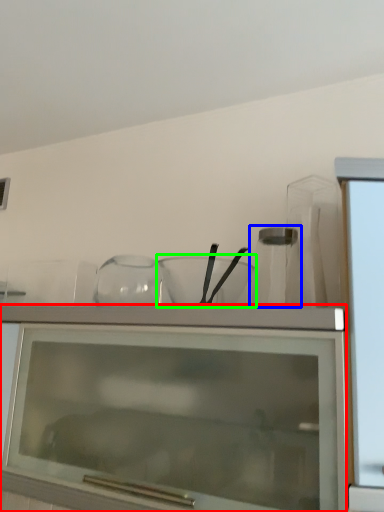
Question: Which is farther away from cabinetry (highlighted by a red box)? glass vase (highlighted by a blue box) or mixing bowl (highlighted by a green box)?

Choices:
 (A) glass vase
 (B) mixing bowl

Answer: (A)